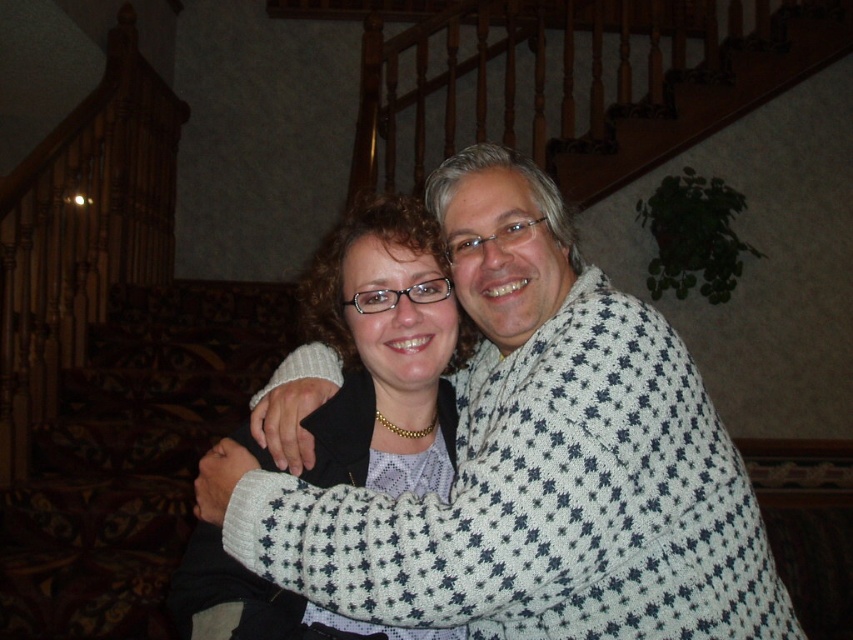
Question: Does white dotted sweater at center appear over white knit sweater at center?

Choices:
 (A) yes
 (B) no

Answer: (A)

Question: Does white dotted sweater at center have a smaller size compared to white knit sweater at center?

Choices:
 (A) yes
 (B) no

Answer: (B)

Question: Among these points, which one is farthest from the camera?

Choices:
 (A) (368, 369)
 (B) (755, 528)

Answer: (A)

Question: Which point is closer to the camera taking this photo?

Choices:
 (A) (613, 424)
 (B) (352, 291)

Answer: (A)

Question: Is white dotted sweater at center bigger than white knit sweater at center?

Choices:
 (A) no
 (B) yes

Answer: (B)